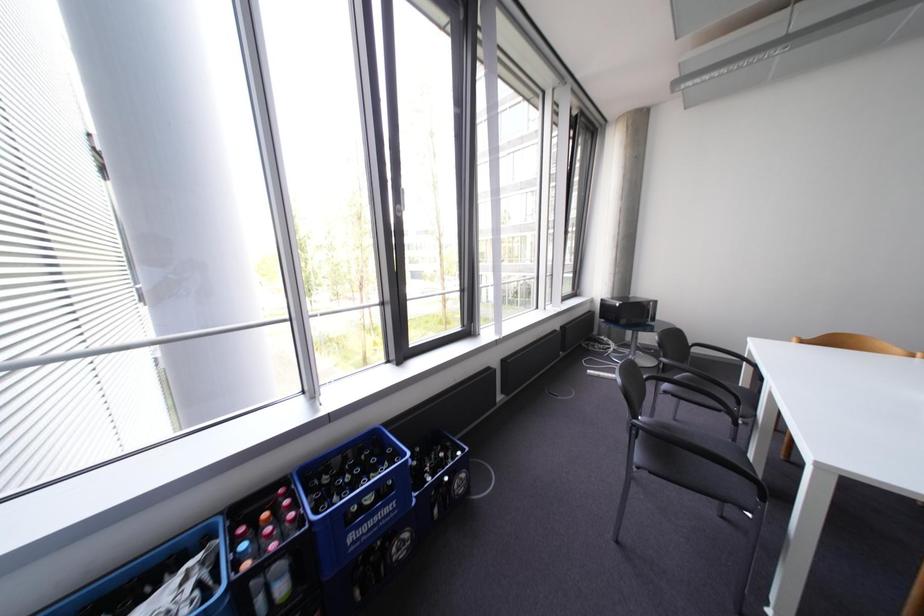
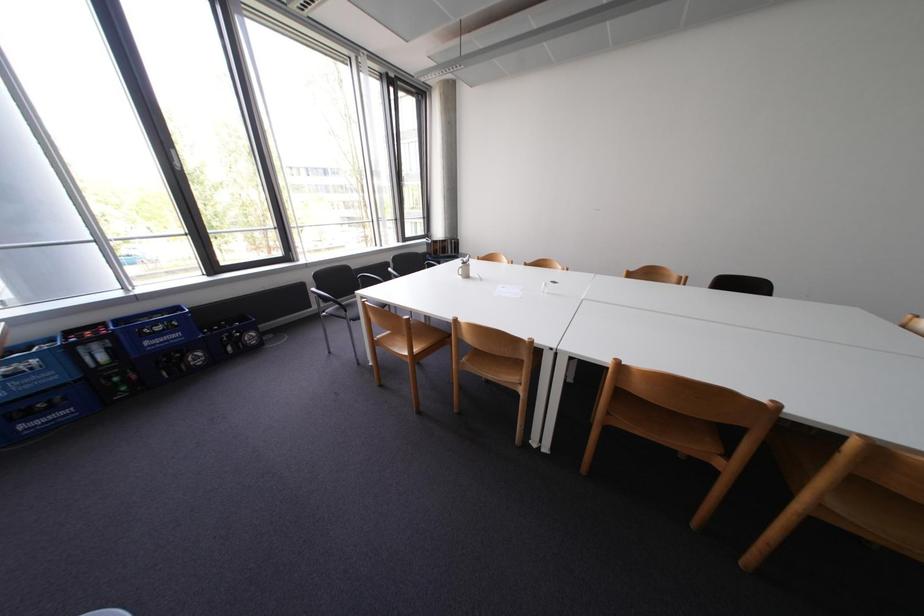
Which direction would the cameraman need to move to produce the second image?

The movement direction of the cameraman is right, backward.